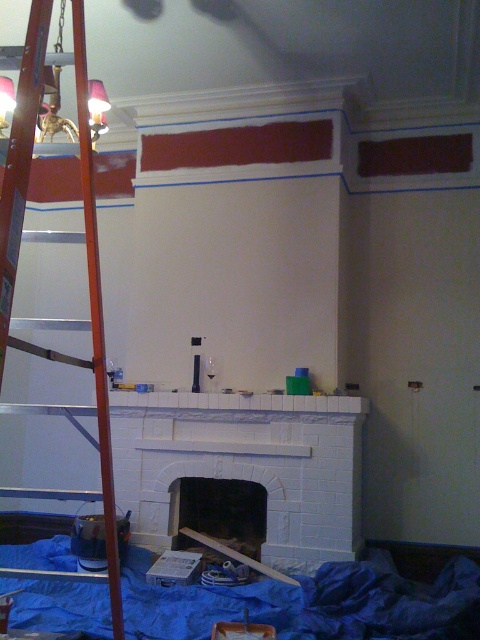
Can you confirm if white brick fireplace at center is bigger than wooden at left?

No, white brick fireplace at center is not bigger than wooden at left.

Who is more forward, (x=167, y=428) or (x=8, y=292)?

Point (x=8, y=292) is in front.

Identify the location of white brick fireplace at center. The width and height of the screenshot is (480, 640). (245, 465).